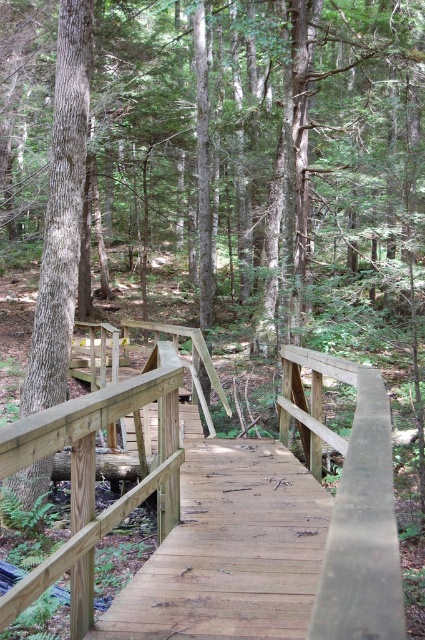
Question: Is wooden bridge at center to the left of smooth brown tree trunk at left from the viewer's perspective?

Choices:
 (A) no
 (B) yes

Answer: (A)

Question: Which point is closer to the camera?

Choices:
 (A) (39, 298)
 (B) (70, 433)

Answer: (B)

Question: Does wooden bridge at center appear over smooth brown tree trunk at left?

Choices:
 (A) no
 (B) yes

Answer: (A)

Question: Is wooden bridge at center bigger than smooth brown tree trunk at left?

Choices:
 (A) no
 (B) yes

Answer: (B)

Question: Among these points, which one is farthest from the camera?

Choices:
 (A) (81, 13)
 (B) (283, 365)

Answer: (A)